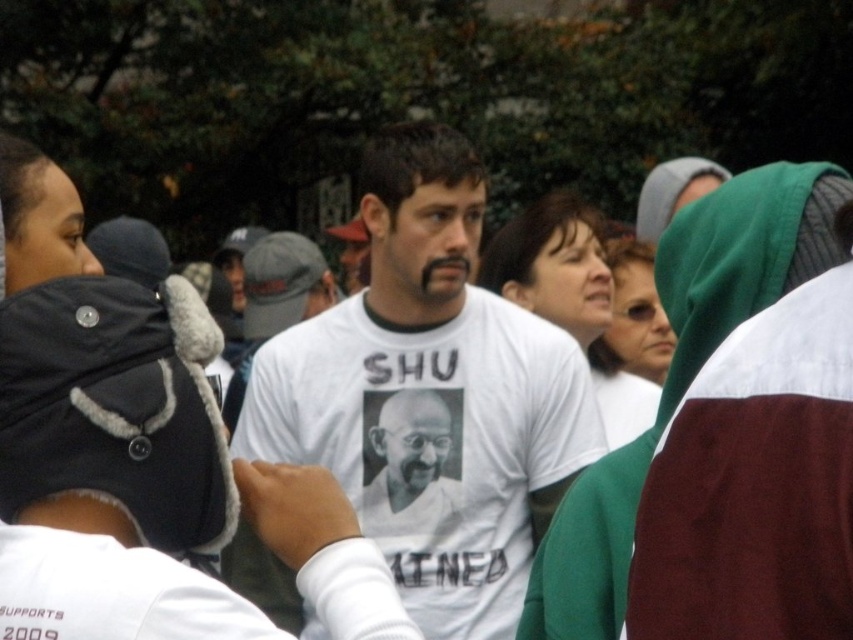
Question: Which object appears closest to the camera in this image?

Choices:
 (A) white t-shirt at center
 (B) white printed t-shirt at center
 (C) green fabric headscarf at upper right

Answer: (C)

Question: Is white t-shirt at center further to the viewer compared to green fabric headscarf at upper right?

Choices:
 (A) no
 (B) yes

Answer: (B)

Question: Which of the following is the farthest from the observer?

Choices:
 (A) (577, 586)
 (B) (384, 484)
 (C) (564, 451)

Answer: (B)

Question: Can you confirm if green fabric headscarf at upper right is positioned to the left of white printed t-shirt at center?

Choices:
 (A) yes
 (B) no

Answer: (B)

Question: Does white t-shirt at center appear on the right side of green fabric headscarf at upper right?

Choices:
 (A) yes
 (B) no

Answer: (B)

Question: Which point is closer to the camera?

Choices:
 (A) (457, 397)
 (B) (306, 397)

Answer: (B)